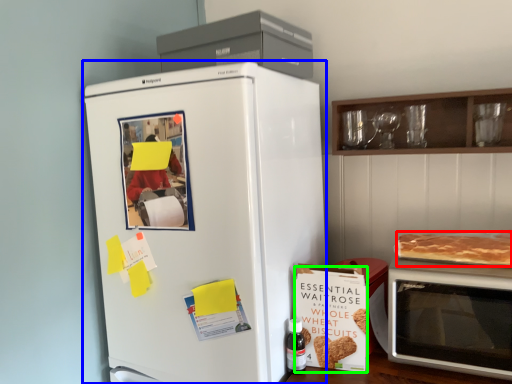
Question: Which object is positioned farthest from pancake (highlighted by a red box)? Select from refrigerator (highlighted by a blue box) and postcard (highlighted by a green box).

Choices:
 (A) refrigerator
 (B) postcard

Answer: (A)